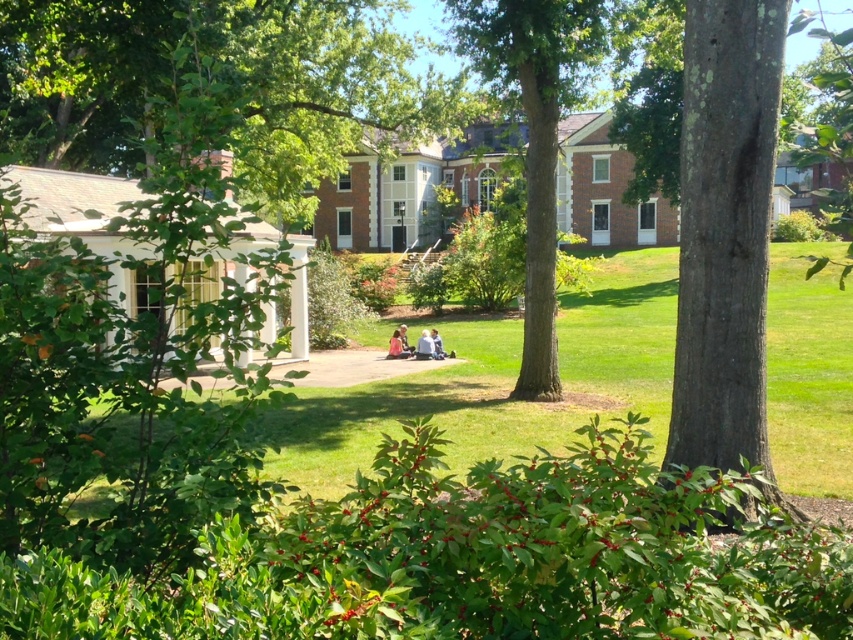
Is green leafy tree at center further to camera compared to green textured tree at center?

No, it is not.

Looking at this image, is green leafy tree at center wider than green textured tree at center?

Yes.

Between point (422, 83) and point (556, 12), which one is positioned behind?

Positioned behind is point (422, 83).

Where is `green leafy tree at center`? This screenshot has height=640, width=853. green leafy tree at center is located at coordinates (216, 86).

Does green leafy tree at center have a lesser height compared to light blue denim jeans at center?

No, green leafy tree at center is not shorter than light blue denim jeans at center.

Who is taller, green leafy tree at center or light blue denim jeans at center?

green leafy tree at center

The image size is (853, 640). Find the location of `green leafy tree at center`. green leafy tree at center is located at coordinates (216, 86).

Image resolution: width=853 pixels, height=640 pixels. Describe the element at coordinates (216, 86) in the screenshot. I see `green leafy tree at center` at that location.

Measure the distance between green leafy tree at center and light brown leather jacket at center.

A distance of 47.29 feet exists between green leafy tree at center and light brown leather jacket at center.

The image size is (853, 640). I want to click on green leafy tree at center, so (216, 86).